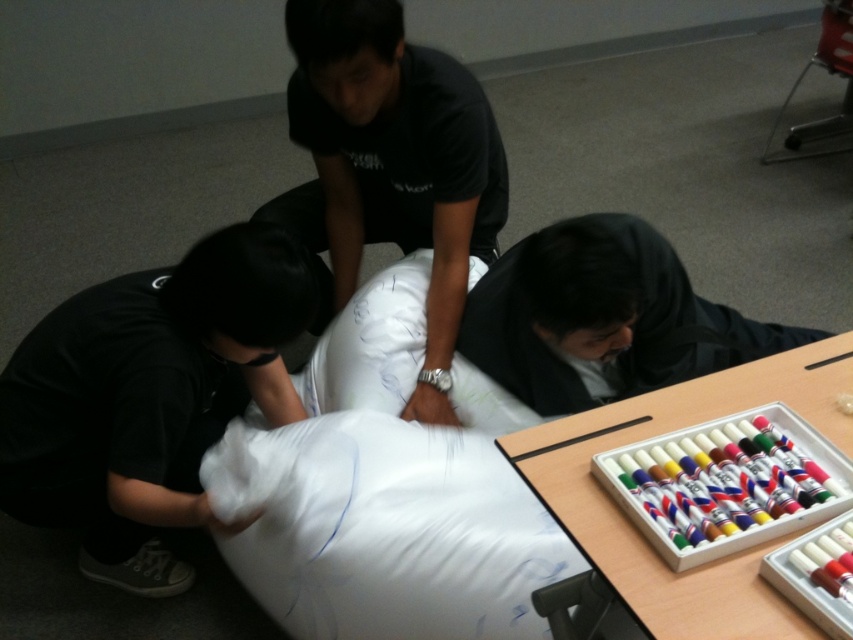
You are an event planner organizing a workshop. You need to place a new sign on the table closest to the person in the black matte shirt at center. Which table should you choose between the wooden table at lower right and another table not shown in the image?

The black matte shirt at center is positioned on the left side of wooden table at lower right, meaning the wooden table at lower right is the closest table to the person in the black matte shirt at center. Therefore, you should place the sign on the wooden table at lower right.

You are organizing a classroom activity and need to move the wooden table at lower right closer to the black matte pillow at lower left. Based on their current positions, which object should you move first to ensure proper alignment?

You should move the wooden table at lower right first because it is currently behind the black matte pillow at lower left, so moving it forward will allow it to align properly with the pillow.

You are standing at the wooden table at lower right and want to hand a marker to the person wearing the black matte shirt at center. Can you reach them without moving from your current position?

The black matte shirt at center is 29.77 inches away from the wooden table at lower right. Since the average human arm length is about 27 inches, you might not be able to reach them without moving.